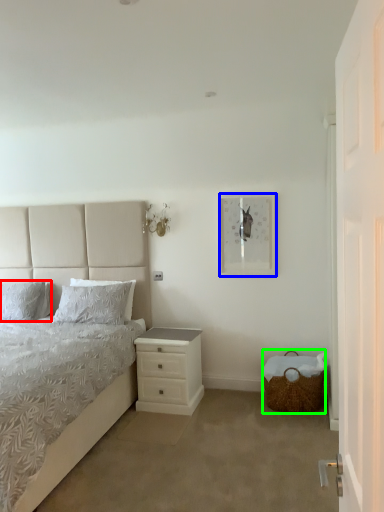
Question: Estimate the real-world distances between objects in this image. Which object is closer to pillow (highlighted by a red box), picture frame (highlighted by a blue box) or basket (highlighted by a green box)?

Choices:
 (A) picture frame
 (B) basket

Answer: (A)